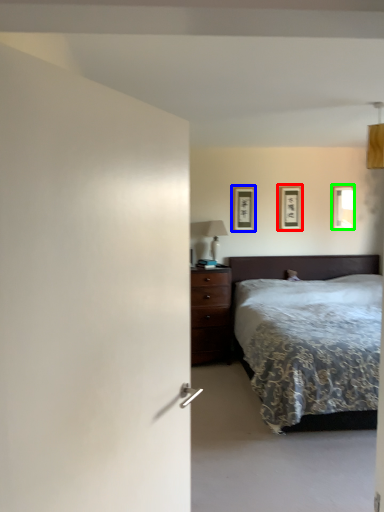
Question: Estimate the real-world distances between objects in this image. Which object is closer to picture frame (highlighted by a red box), picture frame (highlighted by a blue box) or picture frame (highlighted by a green box)?

Choices:
 (A) picture frame
 (B) picture frame

Answer: (A)